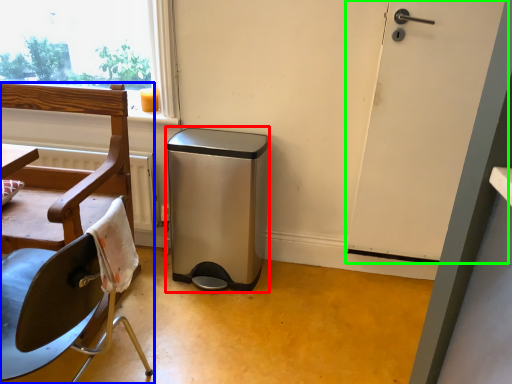
Question: Estimate the real-world distances between objects in this image. Which object is closer to dish washer (highlighted by a red box), chair (highlighted by a blue box) or door (highlighted by a green box)?

Choices:
 (A) chair
 (B) door

Answer: (A)